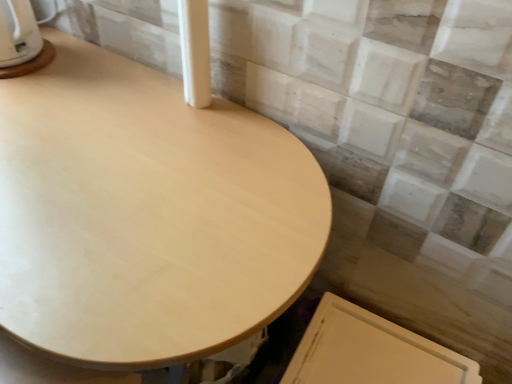
Locate an element on the screen. Image resolution: width=512 pixels, height=384 pixels. empty space that is to the right of white glossy kettle at upper left is located at coordinates (88, 71).